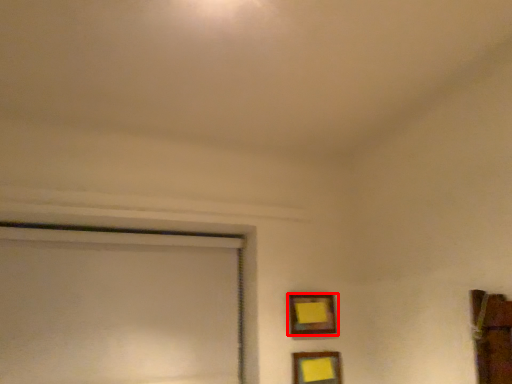
Question: Where is picture frame (annotated by the red box) located in relation to picture frame in the image?

Choices:
 (A) left
 (B) right

Answer: (A)